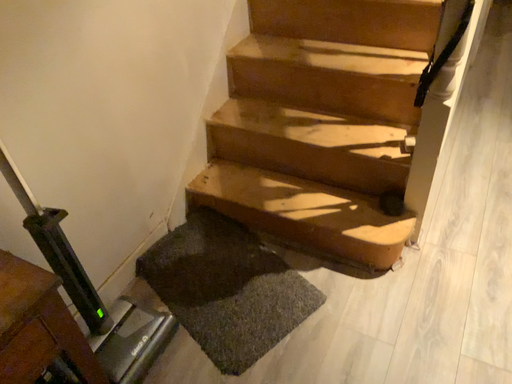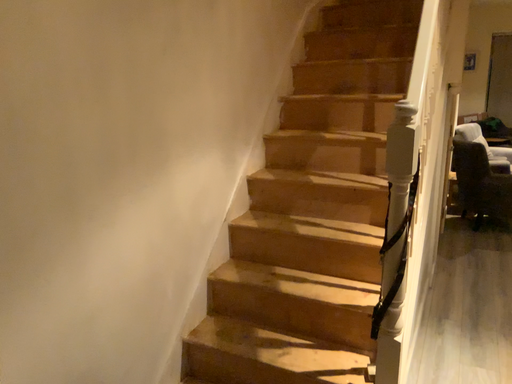
Question: How did the camera likely rotate when shooting the video?

Choices:
 (A) rotated downward
 (B) rotated upward

Answer: (B)